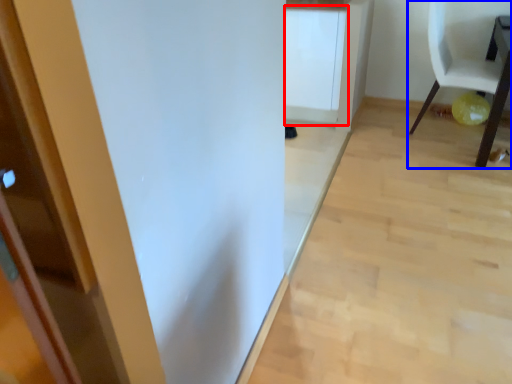
Question: Which point is further to the camera, cabinetry (highlighted by a red box) or chair (highlighted by a blue box)?

Choices:
 (A) cabinetry
 (B) chair

Answer: (A)